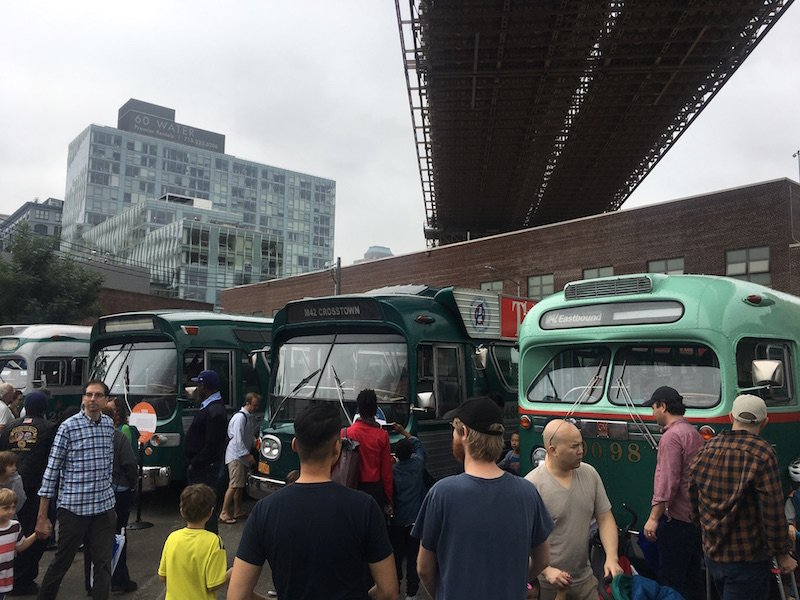
The width and height of the screenshot is (800, 600). What are the coordinates of `windows` in the screenshot? It's located at (150, 205).